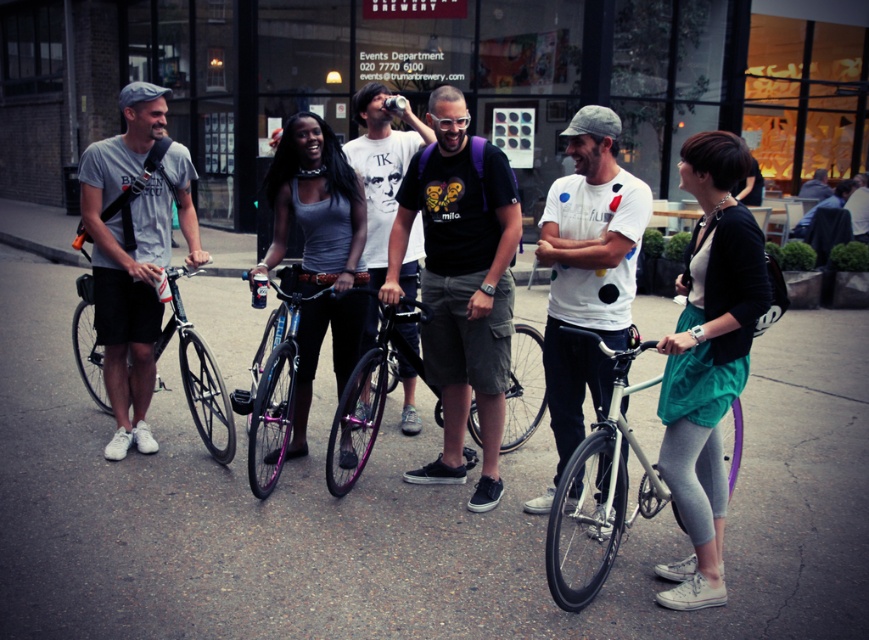
Question: Which point is farther to the camera?

Choices:
 (A) matte gray tank top at center
 (B) white matte bicycle at center
 (C) white matte shirt at center
 (D) purple metallic bicycle at center

Answer: (A)

Question: Which of the following is the farthest from the observer?

Choices:
 (A) matte gray tank top at center
 (B) white matte shirt at center

Answer: (A)

Question: Is black matte t-shirt at center thinner than white matte bicycle at center?

Choices:
 (A) yes
 (B) no

Answer: (A)

Question: Does matte gray tank top at center have a lesser width compared to shiny black bicycle at left?

Choices:
 (A) yes
 (B) no

Answer: (A)

Question: Can you confirm if shiny purple bicycle at center is positioned above dark gray fabric jacket at upper right?

Choices:
 (A) yes
 (B) no

Answer: (B)

Question: Estimate the real-world distances between objects in this image. Which object is farther from the black matte t-shirt at center?

Choices:
 (A) purple metallic bicycle at center
 (B) white matte shirt at center
 (C) shiny black bicycle at left
 (D) dark gray fabric jacket at upper right

Answer: (D)